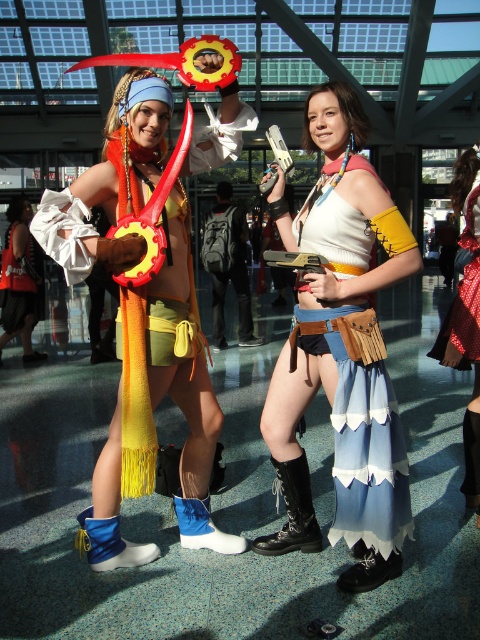
You are at point (220, 81) and want to walk to point (191, 538). Is the path between them clear?

Yes, the path between point (220, 81) and point (191, 538) is clear since point (220, 81) is in front of point (191, 538), indicating no obstruction between them.

You are a photographer at the convention and need to position the two cosplayers so that the matte yellow scarf at left and the silky red dress at center are visible in the frame. Based on their current positions, which object is closer to the left edge of the photo?

The matte yellow scarf at left is closer to the left edge of the photo since it is positioned to the left of the silky red dress at center.

You are a photographer at the convention center and want to take a photo of the two cosplayers. You notice the matte yellow scarf at left and the blue suede boot at lower center. Which object is positioned closer to you?

The matte yellow scarf at left is closer to the viewer than the blue suede boot at lower center.